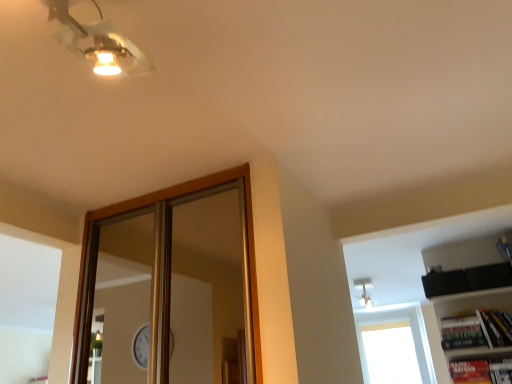
Question: Does metallic gold ceiling light at upper left have a smaller size compared to white glass window at upper right?

Choices:
 (A) no
 (B) yes

Answer: (B)

Question: From the image's perspective, is metallic gold ceiling light at upper left located beneath white glass window at upper right?

Choices:
 (A) yes
 (B) no

Answer: (B)

Question: From a real-world perspective, is metallic gold ceiling light at upper left located higher than white glass window at upper right?

Choices:
 (A) no
 (B) yes

Answer: (B)

Question: Does metallic gold ceiling light at upper left come behind white glass window at upper right?

Choices:
 (A) no
 (B) yes

Answer: (A)

Question: Considering the relative sizes of metallic gold ceiling light at upper left and white glass window at upper right in the image provided, is metallic gold ceiling light at upper left thinner than white glass window at upper right?

Choices:
 (A) yes
 (B) no

Answer: (A)

Question: Can we say metallic gold ceiling light at upper left lies outside white glass window at upper right?

Choices:
 (A) no
 (B) yes

Answer: (B)

Question: Is white glass window at upper right facing towards metallic gold ceiling light at upper left?

Choices:
 (A) yes
 (B) no

Answer: (A)

Question: From a real-world perspective, does white glass window at upper right stand above metallic gold ceiling light at upper left?

Choices:
 (A) no
 (B) yes

Answer: (A)

Question: From the image's perspective, would you say white glass window at upper right is shown under metallic gold ceiling light at upper left?

Choices:
 (A) yes
 (B) no

Answer: (A)

Question: Are white glass window at upper right and metallic gold ceiling light at upper left beside each other?

Choices:
 (A) no
 (B) yes

Answer: (A)

Question: Is white glass window at upper right facing away from metallic gold ceiling light at upper left?

Choices:
 (A) yes
 (B) no

Answer: (B)

Question: Does white glass window at upper right have a larger size compared to metallic gold ceiling light at upper left?

Choices:
 (A) no
 (B) yes

Answer: (B)

Question: Visually, is metallic gold ceiling light at upper left positioned to the left or to the right of white glass window at upper right?

Choices:
 (A) left
 (B) right

Answer: (A)